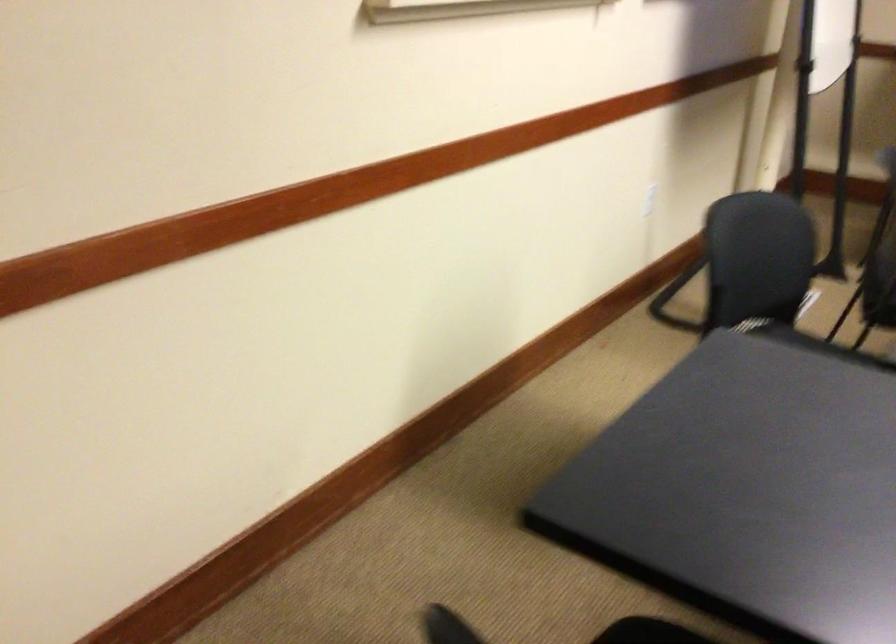
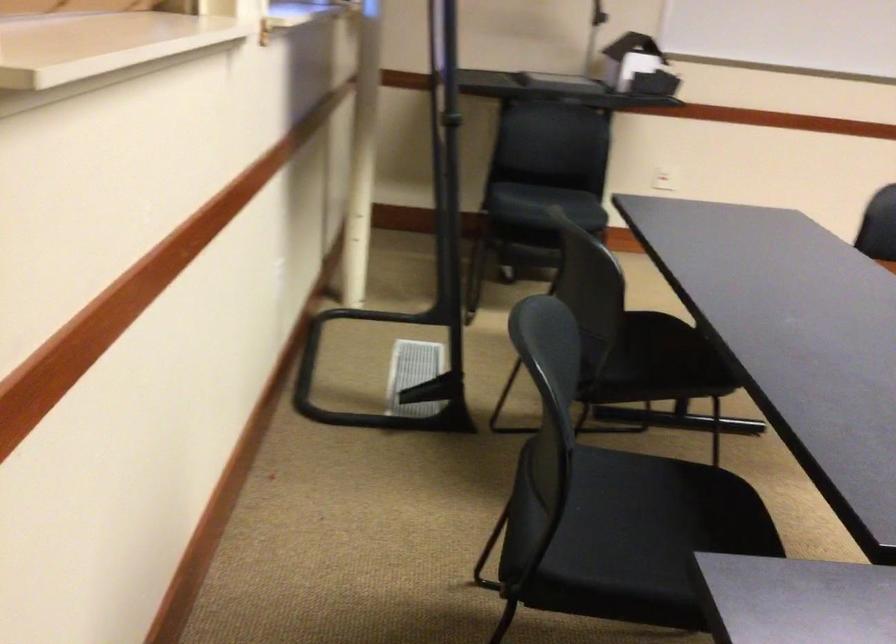
How did the camera likely rotate?

The rotation direction of the camera is right-down.